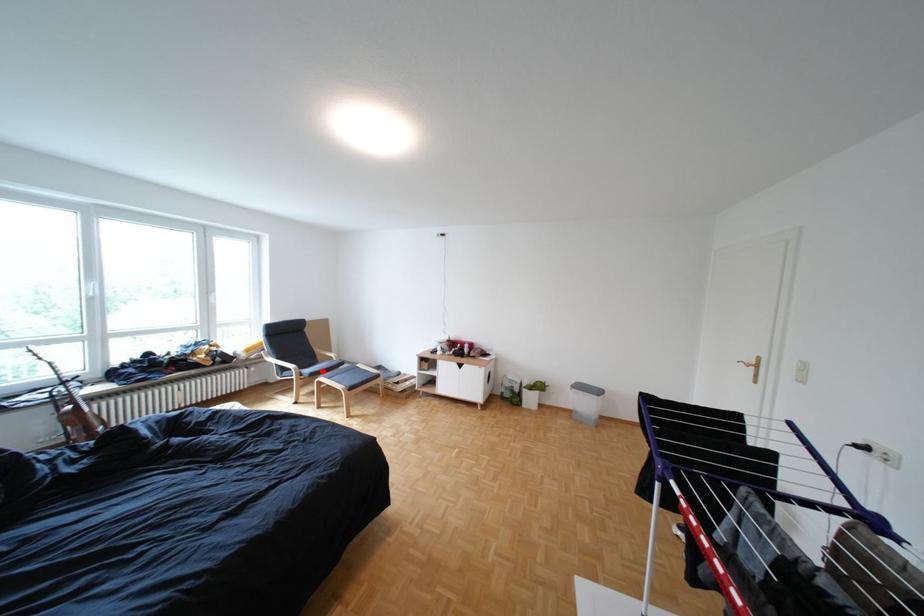
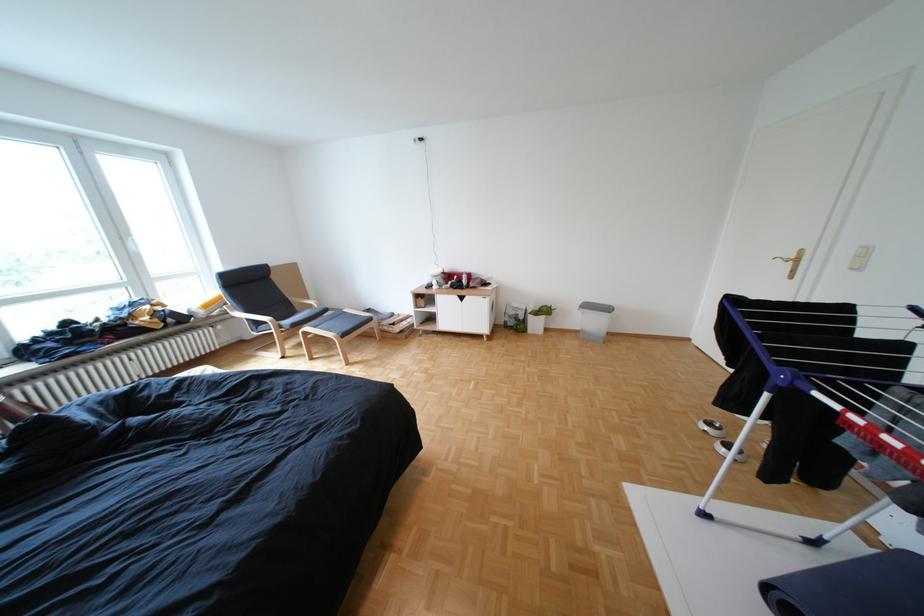
Question: I am providing you with two images of the same scene from different viewpoints. Image1 has a red point marked. In image2, the corresponding 3D location appears at what relative position? Reply with the corresponding letter.

Choices:
 (A) Closer
 (B) Farther

Answer: (B)